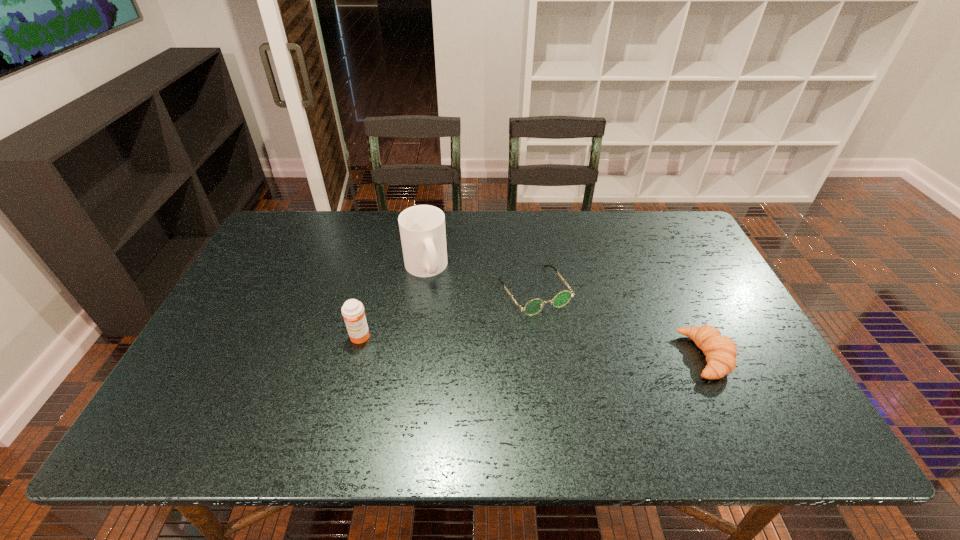
Where is `vacant area at the left edge`? Image resolution: width=960 pixels, height=540 pixels. vacant area at the left edge is located at coordinates (269, 312).

Locate an element on the screen. free location at the right edge of the desktop is located at coordinates (756, 357).

This screenshot has height=540, width=960. I want to click on vacant space at the far left corner, so click(x=283, y=238).

Where is `free space at the far right corner of the desktop`? Image resolution: width=960 pixels, height=540 pixels. free space at the far right corner of the desktop is located at coordinates (642, 227).

Where is `vacant area that lies between the spectacles and the mug`? vacant area that lies between the spectacles and the mug is located at coordinates (480, 279).

The width and height of the screenshot is (960, 540). Find the location of `free space between the third shortest object and the rightmost object`. free space between the third shortest object and the rightmost object is located at coordinates (533, 347).

This screenshot has width=960, height=540. I want to click on free point between the medicine and the tallest object, so click(393, 302).

Find the location of a particular element. The width and height of the screenshot is (960, 540). vacant space that is in between the mug and the third object from left to right is located at coordinates (480, 279).

Where is `empty space that is in between the medicine and the third object from right to left`? empty space that is in between the medicine and the third object from right to left is located at coordinates (393, 302).

Where is `vacant space that is in between the rightmost object and the mug`? This screenshot has height=540, width=960. vacant space that is in between the rightmost object and the mug is located at coordinates (565, 312).